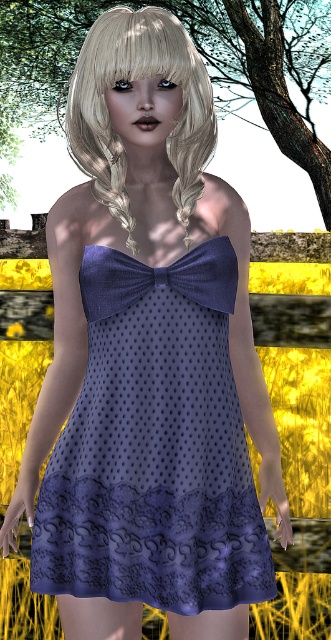
Does green leafy tree at upper center have a greater height compared to blondehair at center?

Correct, green leafy tree at upper center is much taller as blondehair at center.

Which is above, green leafy tree at upper center or blondehair at center?

green leafy tree at upper center is higher up.

Locate an element on the screen. green leafy tree at upper center is located at coordinates (202, 58).

Which of these two, matte purple dress at center or blondehair at center, stands taller?

matte purple dress at center

Is matte purple dress at center smaller than blondehair at center?

Yes.

The image size is (331, 640). I want to click on matte purple dress at center, so click(x=154, y=445).

Is matte purple dress at center positioned behind green leafy tree at upper center?

No, matte purple dress at center is in front of green leafy tree at upper center.

Between matte purple dress at center and green leafy tree at upper center, which one is positioned higher?

green leafy tree at upper center

This screenshot has width=331, height=640. What are the coordinates of `matte purple dress at center` in the screenshot? It's located at click(x=154, y=445).